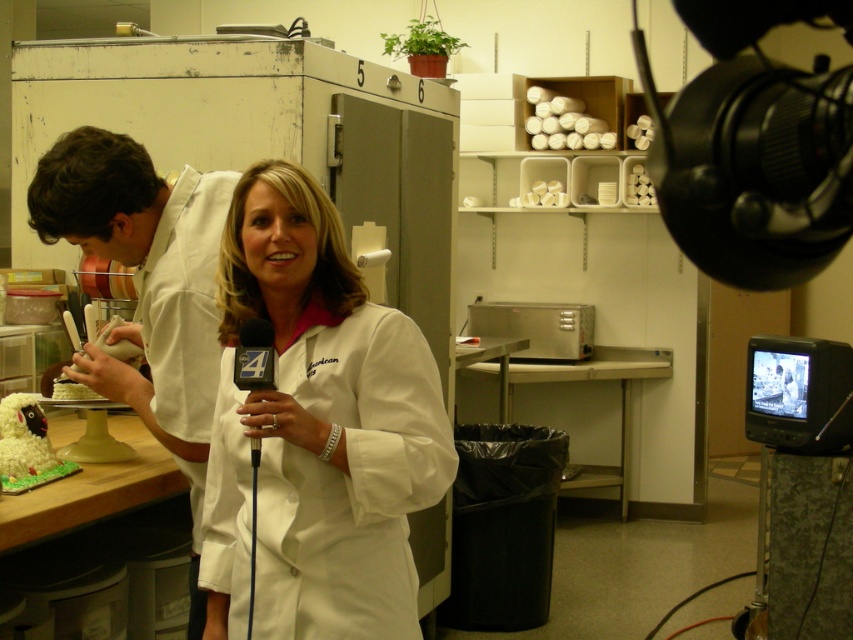
Between black plastic video camera at upper right and black plastic microphone at center, which one is positioned lower?

black plastic microphone at center is below.

Does black plastic video camera at upper right lie in front of black plastic microphone at center?

That is True.

The image size is (853, 640). What do you see at coordinates (753, 147) in the screenshot?
I see `black plastic video camera at upper right` at bounding box center [753, 147].

Where is `black plastic video camera at upper right`? black plastic video camera at upper right is located at coordinates (753, 147).

Is white lab coat at center below black plastic microphone at center?

Yes, white lab coat at center is below black plastic microphone at center.

Can you confirm if white lab coat at center is positioned to the left of black plastic microphone at center?

Incorrect, white lab coat at center is not on the left side of black plastic microphone at center.

You are a GUI agent. You are given a task and a screenshot of the screen. Output one action in this format:
    pyautogui.click(x=<x>, y=<y>)
    Task: Click on the white lab coat at center
    This screenshot has height=640, width=853.
    Given the screenshot: What is the action you would take?
    pyautogui.click(x=316, y=429)

Can you confirm if white lab coat at center is wider than white matte chef coat at left?

Indeed, white lab coat at center has a greater width compared to white matte chef coat at left.

Is white lab coat at center in front of white matte chef coat at left?

Yes, it is.

Is point (271, 257) more distant than point (169, 435)?

No.

At what (x,y) coordinates should I click in order to perform the action: click on white lab coat at center. Please return your answer as a coordinate pair (x, y). Looking at the image, I should click on (316, 429).